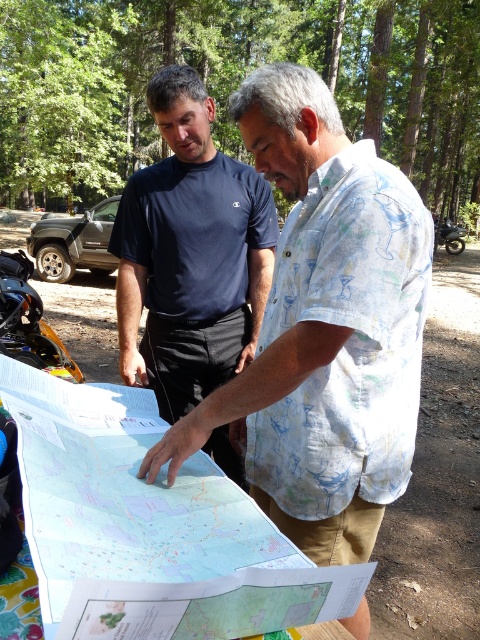
Can you confirm if dark blue t-shirt at center is bigger than orange metallic motorcycle at lower left?

Indeed, dark blue t-shirt at center has a larger size compared to orange metallic motorcycle at lower left.

Who is positioned more to the left, dark blue t-shirt at center or orange metallic motorcycle at lower left?

orange metallic motorcycle at lower left

Where is `dark blue t-shirt at center`? dark blue t-shirt at center is located at coordinates (191, 253).

This screenshot has height=640, width=480. In order to click on dark blue t-shirt at center in this screenshot , I will do `click(191, 253)`.

Is white printed shirt at center positioned behind orange metallic motorcycle at lower left?

No, it is in front of orange metallic motorcycle at lower left.

Who is taller, white printed shirt at center or orange metallic motorcycle at lower left?

white printed shirt at center

This screenshot has width=480, height=640. Describe the element at coordinates (324, 328) in the screenshot. I see `white printed shirt at center` at that location.

The width and height of the screenshot is (480, 640). I want to click on white printed shirt at center, so click(324, 328).

What do you see at coordinates (148, 525) in the screenshot?
I see `light blue paper map at center` at bounding box center [148, 525].

Who is more distant from viewer, [36,417] or [173,417]?

Positioned behind is point [173,417].

Between point (25, 392) and point (179, 122), which one is positioned in front?

Point (25, 392) is in front.

You are a GUI agent. You are given a task and a screenshot of the screen. Output one action in this format:
    pyautogui.click(x=<x>, y=<y>)
    Task: Click on the light blue paper map at center
    
    Given the screenshot: What is the action you would take?
    pyautogui.click(x=148, y=525)